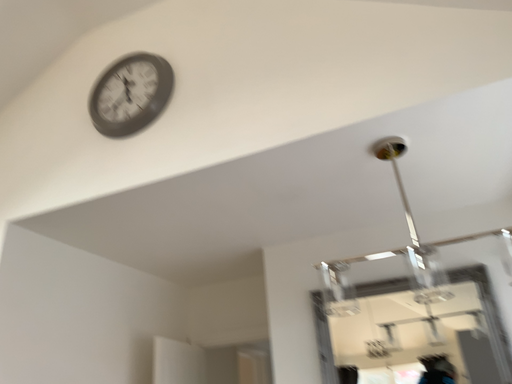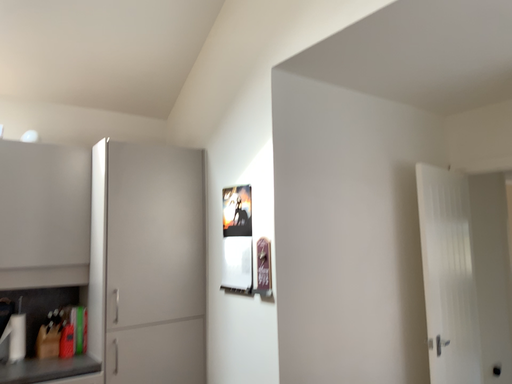
Question: Which way did the camera rotate in the video?

Choices:
 (A) rotated left
 (B) rotated right

Answer: (A)